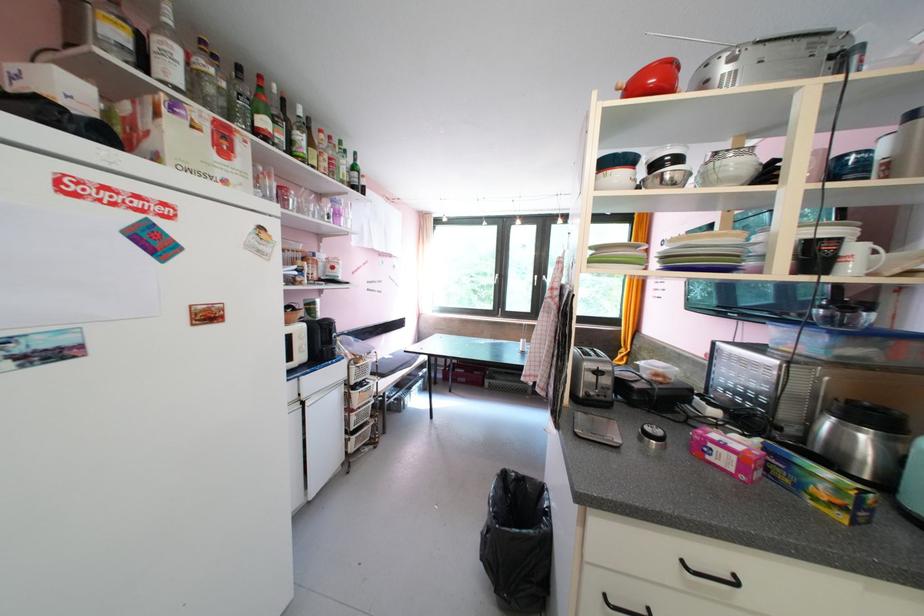
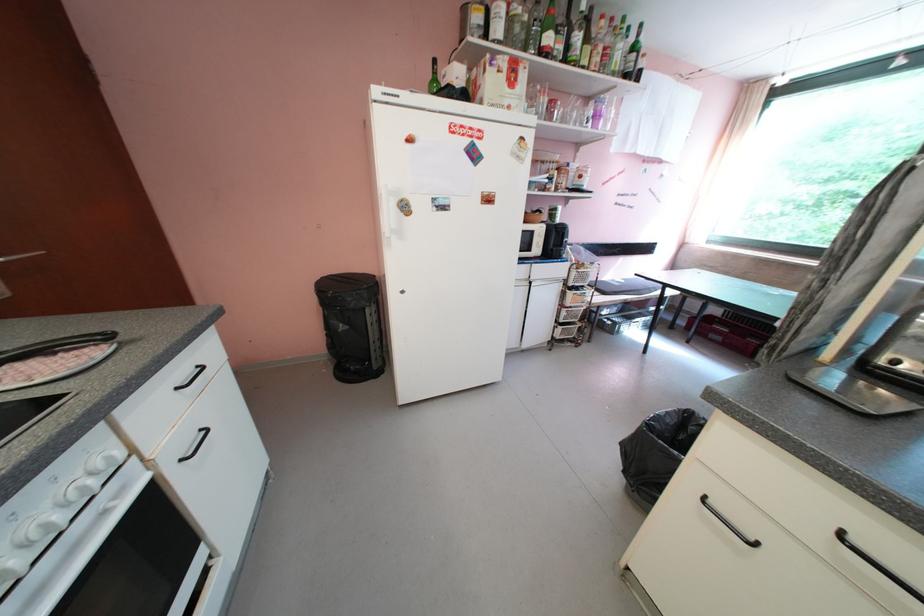
Find the pixel in the second image that matches point 361,440 in the first image.

(568, 330)